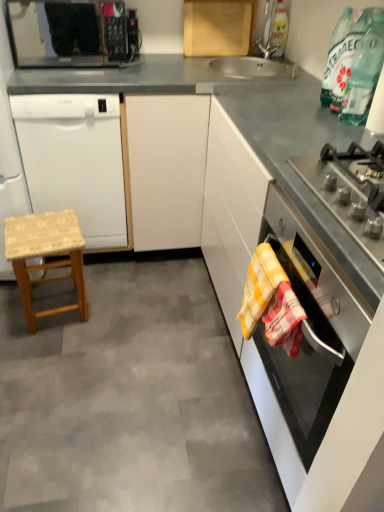
Locate an element on the screen. The image size is (384, 512). vacant area situated below woven wood stool at lower left (from a real-world perspective) is located at coordinates (62, 313).